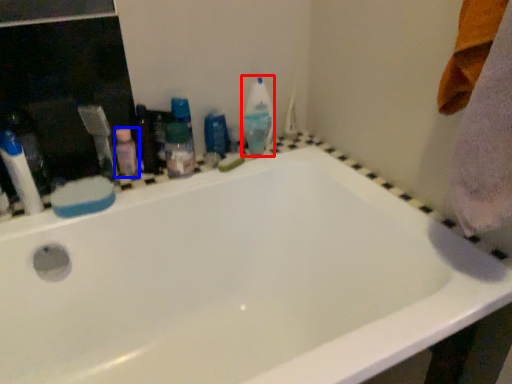
Question: Which of the following is the closest to the observer, cleaning product (highlighted by a red box) or toiletry (highlighted by a blue box)?

Choices:
 (A) cleaning product
 (B) toiletry

Answer: (B)